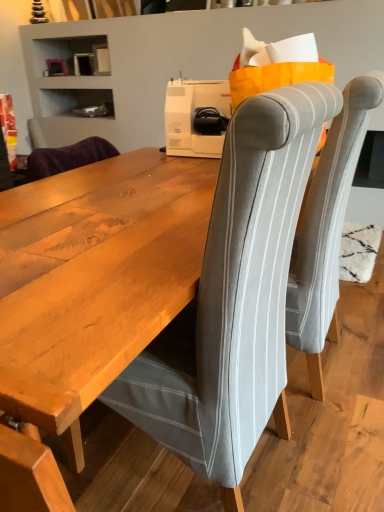
This screenshot has height=512, width=384. What do you see at coordinates (234, 298) in the screenshot?
I see `gray striped fabric chair at center` at bounding box center [234, 298].

This screenshot has height=512, width=384. I want to click on gray striped fabric chair at center, so click(x=234, y=298).

The image size is (384, 512). I want to click on gray striped fabric chair at center, so click(234, 298).